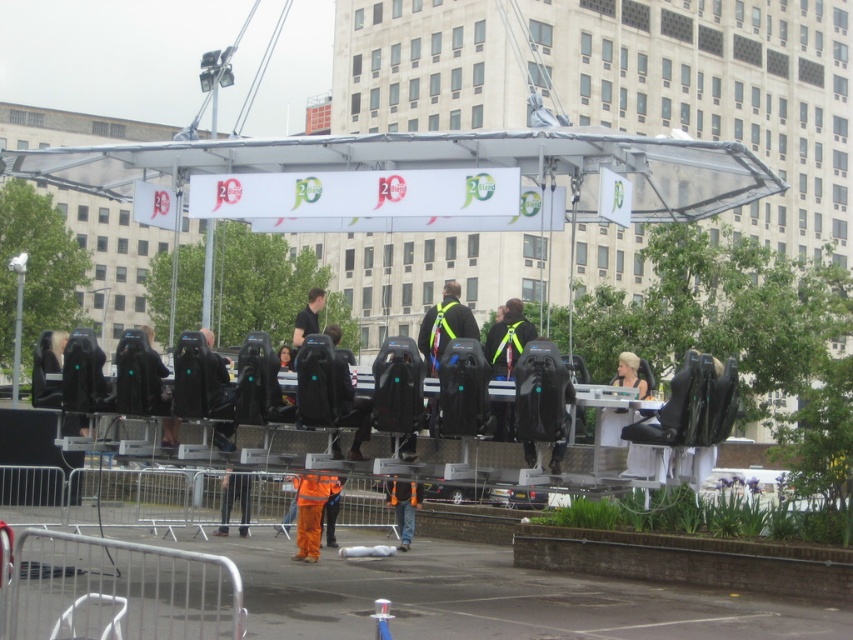
You are planning to install a new light fixture in the area where the transparent plastic canopy at upper center and orange reflective safety vest at center are located. Considering their sizes, which object might require more space for the installation?

The transparent plastic canopy at upper center is bigger than the orange reflective safety vest at center, so it would require more space for the installation.

You are a visitor at this event and need to choose between wearing the orange reflective safety vest at center and the black fabric jacket at center. Which one would you pick if you want to wear the smaller item?

The orange reflective safety vest at center is smaller than the black fabric jacket at center, so you should choose the orange reflective safety vest at center.